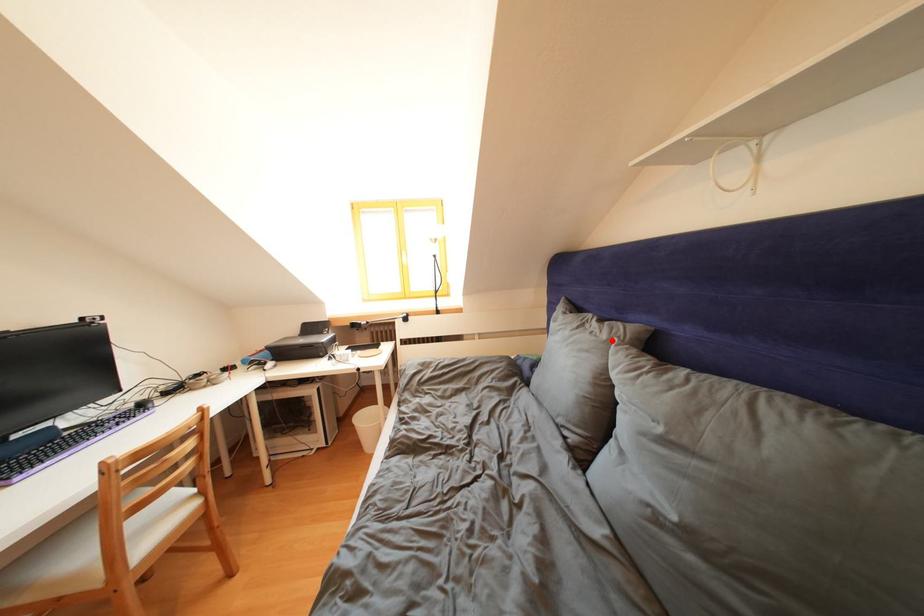
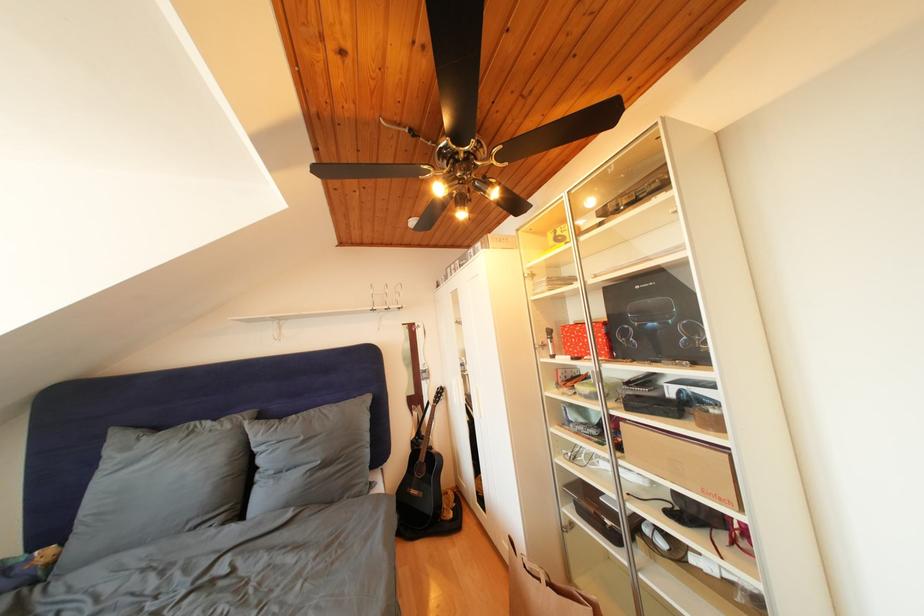
The point at the highlighted location is marked in the first image. Where is the corresponding point in the second image?

(236, 432)